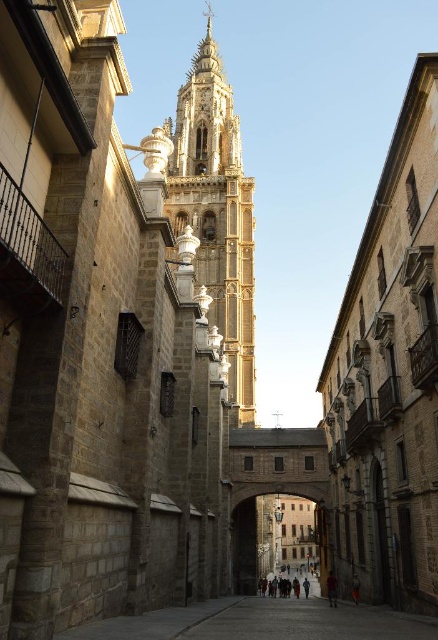
Does golden stone tower at center appear on the left side of dark gray stone people at center?

Correct, you'll find golden stone tower at center to the left of dark gray stone people at center.

Is point (214, 220) closer to camera compared to point (272, 589)?

That is False.

Identify the location of golden stone tower at center. This screenshot has width=438, height=640. click(216, 211).

Which is behind, point (296, 593) or point (332, 573)?

The point (296, 593) is more distant.

Which is below, dark gray stone people at center or dark red fabric at center?

Positioned lower is dark gray stone people at center.

Is point (264, 579) farther from camera compared to point (332, 573)?

Yes, it is behind point (332, 573).

This screenshot has height=640, width=438. Find the location of `dark gray stone people at center`. dark gray stone people at center is located at coordinates (296, 586).

Who is positioned more to the left, smooth stone church at center or dark red fabric at center?

dark red fabric at center

Is smooth stone church at center closer to the viewer compared to dark red fabric at center?

Yes, smooth stone church at center is closer to the viewer.

Between point (403, 362) and point (328, 592), which one is positioned behind?

Positioned behind is point (328, 592).

Identify the location of smooth stone church at center. (389, 372).